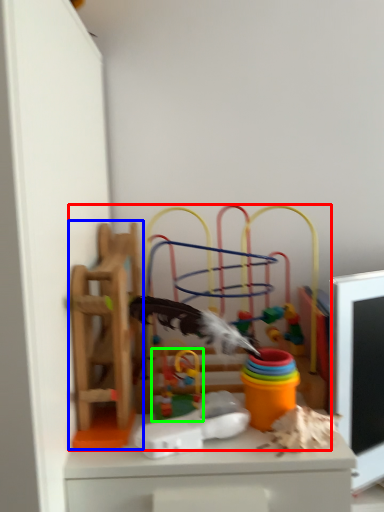
Question: Which object is the closest to the toy (highlighted by a red box)? Choose among these: toy (highlighted by a blue box) or toy (highlighted by a green box).

Choices:
 (A) toy
 (B) toy

Answer: (A)